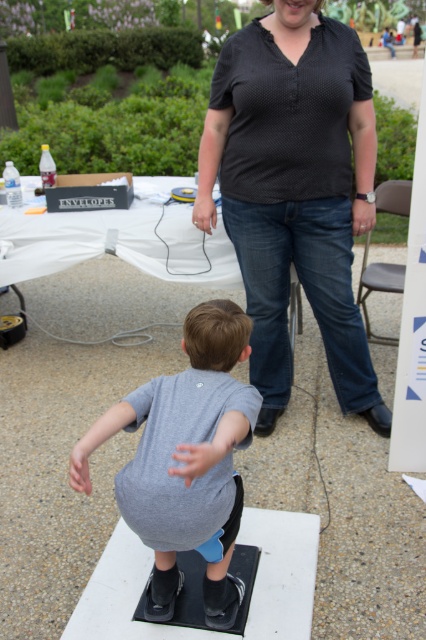
Question: Which of the following is the closest to the observer?

Choices:
 (A) gray matte shirt at center
 (B) black dotted shirt at center

Answer: (A)

Question: Can you confirm if black dotted shirt at center is thinner than gray matte shirt at center?

Choices:
 (A) yes
 (B) no

Answer: (B)

Question: Among these objects, which one is farthest from the camera?

Choices:
 (A) gray matte shirt at center
 (B) black dotted shirt at center

Answer: (B)

Question: Is black dotted shirt at center smaller than gray matte shirt at center?

Choices:
 (A) no
 (B) yes

Answer: (A)

Question: Does black dotted shirt at center appear on the left side of gray matte shirt at center?

Choices:
 (A) no
 (B) yes

Answer: (A)